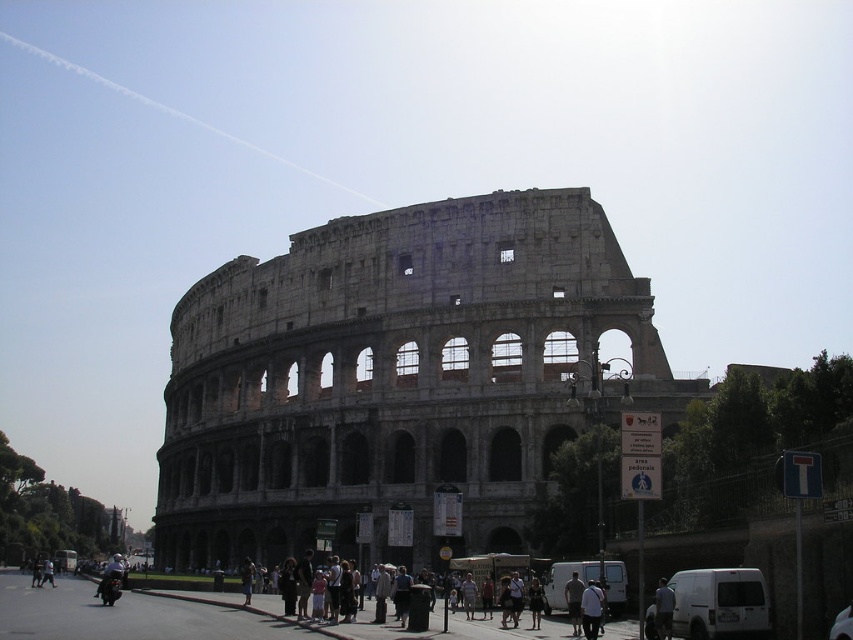
Question: Among these objects, which one is nearest to the camera?

Choices:
 (A) light blue shirt at center
 (B) gray stone amphitheater at center

Answer: (A)

Question: Can you confirm if gray stone amphitheater at center is positioned to the left of light blue shirt at center?

Choices:
 (A) no
 (B) yes

Answer: (B)

Question: Which point is closer to the camera?

Choices:
 (A) (573, 632)
 (B) (276, 451)
 (C) (668, 609)

Answer: (C)

Question: Which of the following is the closest to the observer?

Choices:
 (A) (248, 474)
 (B) (660, 632)
 (C) (575, 586)

Answer: (B)

Question: Is gray stone amphitheater at center thinner than light blue shirt at center?

Choices:
 (A) no
 (B) yes

Answer: (A)

Question: Does gray stone amphitheater at center come behind light blue shirt at center?

Choices:
 (A) yes
 (B) no

Answer: (A)